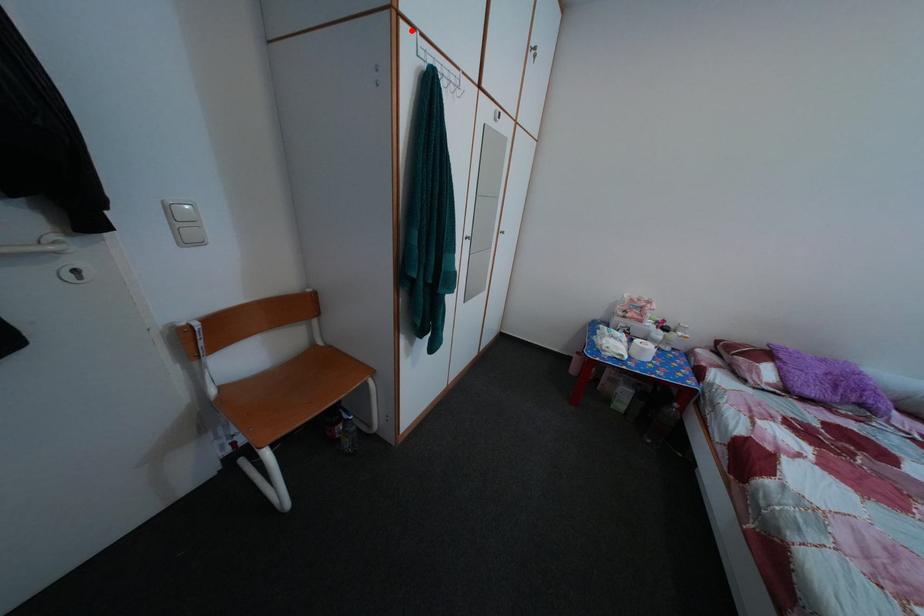
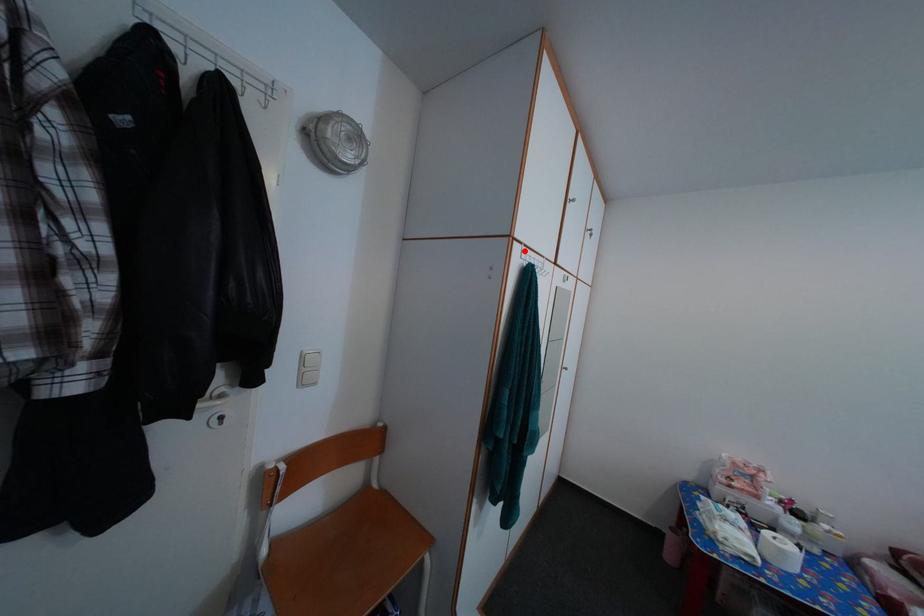
I am providing you with two images of the same scene from different viewpoints. A red point is marked on the first image and another point is marked on the second image. Does the point marked in image1 correspond to the same location as the one in image2?

Yes